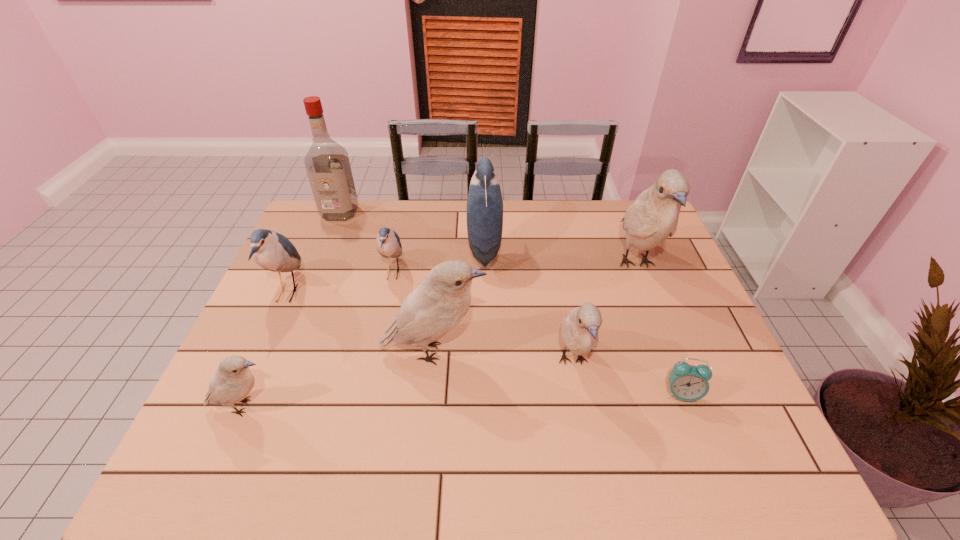
The height and width of the screenshot is (540, 960). I want to click on free space between the shortest object and the farthest object, so click(511, 303).

Identify the location of vacant space that is in between the rightmost blue bird and the second blue bird from right to left. (439, 261).

Identify the location of object that stands as the sixth closest to the biggest blue bird. (272, 251).

Select which object is the closest to the alarm clock. Please provide its 2D coordinates. Your answer should be formatted as a tuple, i.e. [(x, y)], where the tuple contains the x and y coordinates of a point satisfying the conditions above.

[(579, 330)]

Locate which bird is the fifth closest to the biggest blue bird. Please provide its 2D coordinates. Your answer should be formatted as a tuple, i.e. [(x, y)], where the tuple contains the x and y coordinates of a point satisfying the conditions above.

[(272, 251)]

Locate an element on the screen. bird that is the fifth closest to the biggest white bird is located at coordinates (232, 382).

I want to click on white bird object that ranks as the third closest to the second biggest white bird, so click(653, 217).

Locate which white bird ranks second in proximity to the third white bird from right to left. Please provide its 2D coordinates. Your answer should be formatted as a tuple, i.e. [(x, y)], where the tuple contains the x and y coordinates of a point satisfying the conditions above.

[(232, 382)]

You are a GUI agent. You are given a task and a screenshot of the screen. Output one action in this format:
    pyautogui.click(x=<x>, y=<y>)
    Task: Click on the closest blue bird to the second blue bird from right to left
    This screenshot has width=960, height=540.
    Given the screenshot: What is the action you would take?
    pyautogui.click(x=484, y=204)

The height and width of the screenshot is (540, 960). I want to click on the second closest blue bird to the second smallest blue bird, so click(x=484, y=204).